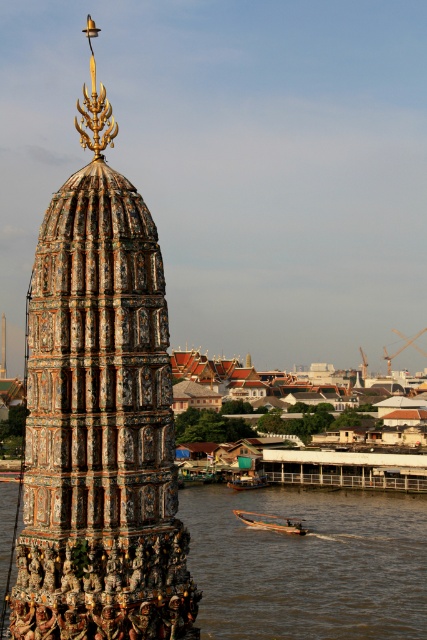
Question: Which of the following is the farthest from the observer?

Choices:
 (A) multicolored mosaic tower at center
 (B) brown water at lower center
 (C) wooden planks boat at lower center

Answer: (C)

Question: Among these points, which one is farthest from the camera?

Choices:
 (A) (25, 522)
 (B) (249, 524)

Answer: (B)

Question: Can you confirm if brown water at lower center is thinner than wooden planks boat at lower center?

Choices:
 (A) yes
 (B) no

Answer: (B)

Question: Is brown water at lower center thinner than wooden boat at lower center?

Choices:
 (A) no
 (B) yes

Answer: (A)

Question: Is brown water at lower center bigger than wooden boat at lower center?

Choices:
 (A) no
 (B) yes

Answer: (B)

Question: Estimate the real-world distances between objects in this image. Which object is closer to the wooden planks boat at lower center?

Choices:
 (A) brown water at lower center
 (B) wooden boat at lower center

Answer: (B)